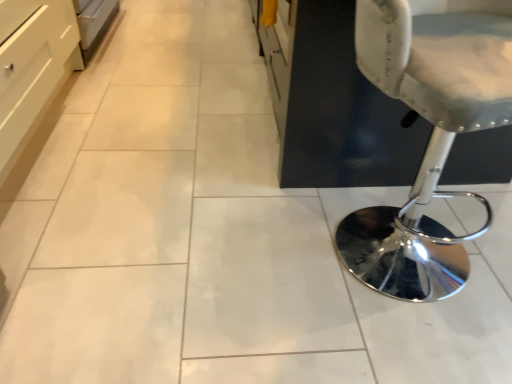
Question: In the image, is white leather stool at right positioned in front of or behind white glossy drawer at left?

Choices:
 (A) behind
 (B) front

Answer: (B)

Question: Is white leather stool at right inside the boundaries of white glossy drawer at left, or outside?

Choices:
 (A) inside
 (B) outside

Answer: (B)

Question: Considering the positions of white leather stool at right and white glossy drawer at left in the image, is white leather stool at right taller or shorter than white glossy drawer at left?

Choices:
 (A) tall
 (B) short

Answer: (A)

Question: Which is correct: white glossy drawer at left is inside white leather stool at right, or outside of it?

Choices:
 (A) outside
 (B) inside

Answer: (A)

Question: Is point (30, 134) closer or farther from the camera than point (451, 193)?

Choices:
 (A) closer
 (B) farther

Answer: (A)

Question: Relative to white leather stool at right, is white glossy drawer at left in front or behind?

Choices:
 (A) front
 (B) behind

Answer: (B)

Question: From the image's perspective, is white glossy drawer at left positioned above or below white leather stool at right?

Choices:
 (A) above
 (B) below

Answer: (A)